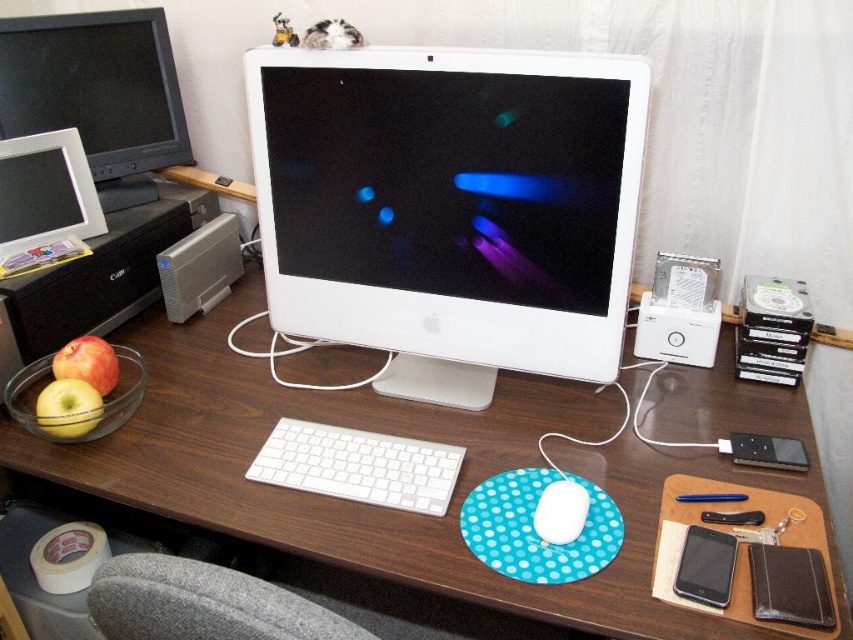
You are standing in front of the computer workstation described. There are two points marked on the desk. The first point is at coordinate location point (618, 116) and the second point is at point (68, 435). If you were to walk towards the desk, which point would you encounter first?

Point (618, 116) is in front of point (68, 435), so you would encounter point (618, 116) first as you approach the desk.

In the scene shown: You are setting up a new webcam for streaming. The ideal position for the webcam is at coordinates approximately 0.3, 0.5 on the desk. Is the white glossy computer monitor at center positioned close enough to this target location?

The white glossy computer monitor at center is located at point (450,209), which is very close to the desired coordinates of (426,192). Therefore, the monitor is positioned close enough to the target location for the webcam setup.